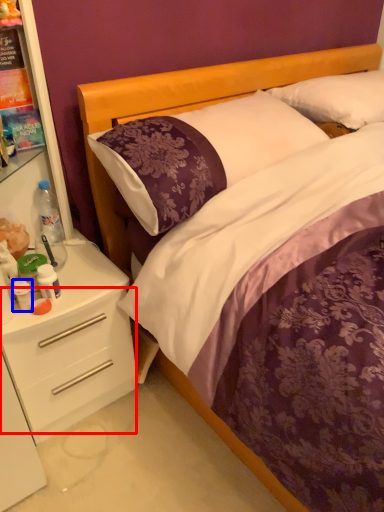
Question: Among these objects, which one is nearest to the camera, drawer (highlighted by a red box) or bottle (highlighted by a blue box)?

Choices:
 (A) drawer
 (B) bottle

Answer: (A)